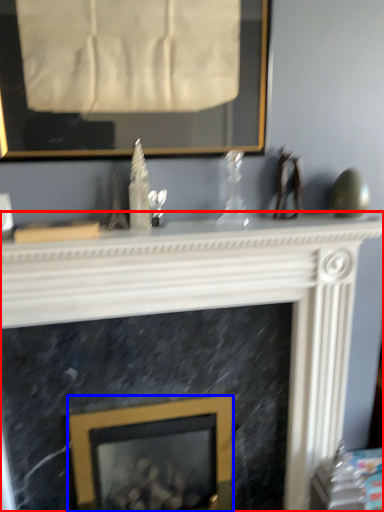
Question: Which object is closer to the camera taking this photo, fireplace (highlighted by a red box) or picture frame (highlighted by a blue box)?

Choices:
 (A) fireplace
 (B) picture frame

Answer: (A)